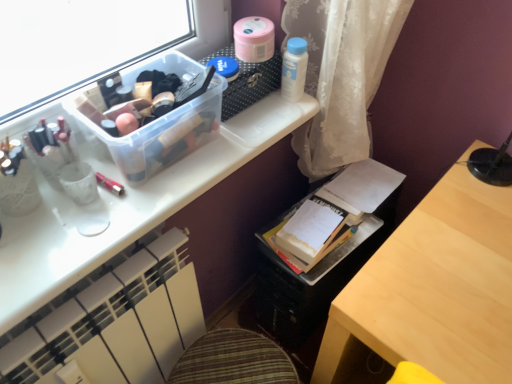
The width and height of the screenshot is (512, 384). Find the location of `unoccupied area in front of white plastic bottle at upper right, which is the first toiletry in back-to-front order`. unoccupied area in front of white plastic bottle at upper right, which is the first toiletry in back-to-front order is located at coordinates (266, 124).